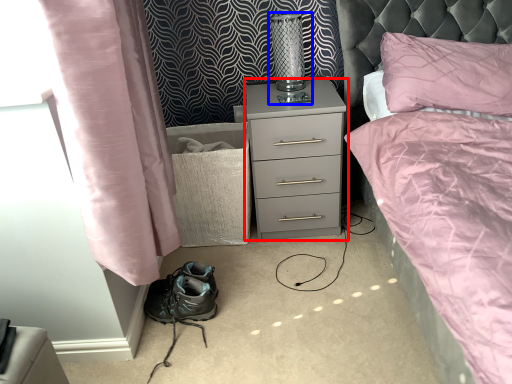
Question: Which object is closer to the camera taking this photo, nightstand (highlighted by a red box) or bedside lamp (highlighted by a blue box)?

Choices:
 (A) nightstand
 (B) bedside lamp

Answer: (A)